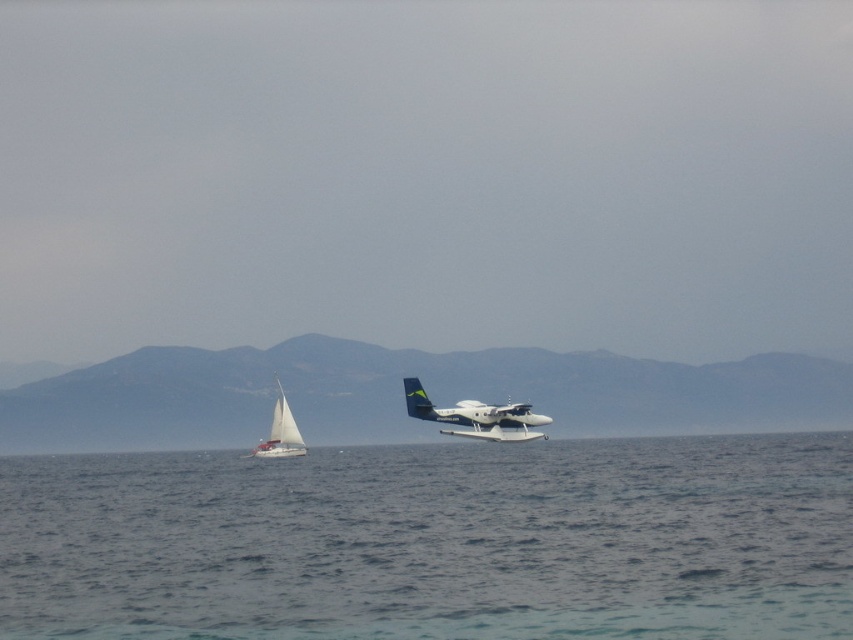
Question: Which point is closer to the camera?

Choices:
 (A) (35, 513)
 (B) (445, 429)
 (C) (291, 417)

Answer: (A)

Question: Which object is farther from the camera taking this photo?

Choices:
 (A) white matte sailboat at left
 (B) white glossy seaplane at center

Answer: (A)

Question: Can you confirm if clear blue water at center is wider than white matte sailboat at left?

Choices:
 (A) yes
 (B) no

Answer: (A)

Question: Is clear blue water at center closer to camera compared to white matte sailboat at left?

Choices:
 (A) no
 (B) yes

Answer: (B)

Question: Which of the following is the farthest from the observer?

Choices:
 (A) white glossy seaplane at center
 (B) clear blue water at center
 (C) white matte sailboat at left

Answer: (C)

Question: Is the position of clear blue water at center less distant than that of white glossy seaplane at center?

Choices:
 (A) yes
 (B) no

Answer: (A)